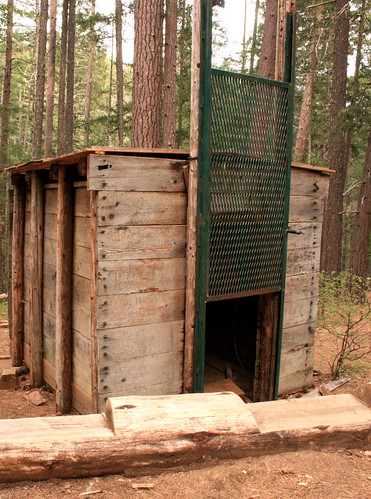
In order to click on seat in this screenshot , I will do `click(57, 437)`, `click(299, 421)`.